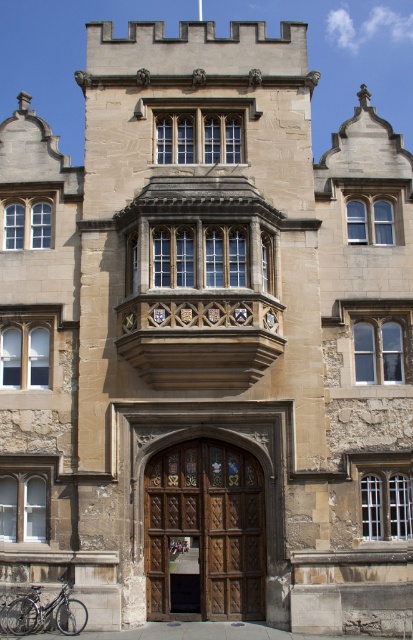
Is brown wooden door at center positioned behind shiny metallic bicycle at lower left?

Yes, it is behind shiny metallic bicycle at lower left.

Where is `brown wooden door at center`? This screenshot has height=640, width=413. brown wooden door at center is located at coordinates (204, 532).

Identify the location of brown wooden door at center. (204, 532).